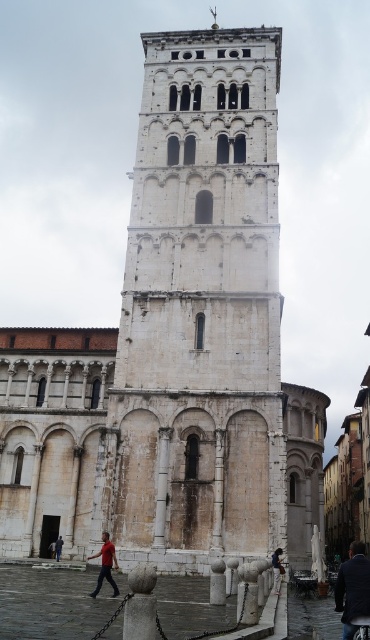
Question: Among these points, which one is farthest from the camera?

Choices:
 (A) (351, 556)
 (B) (112, 545)
 (C) (250, 48)

Answer: (A)

Question: Among these objects, which one is farthest from the camera?

Choices:
 (A) red cotton shirt at lower left
 (B) dark blue jeans at lower right
 (C) dark blue fabric jacket at lower right

Answer: (B)

Question: Can you confirm if red cotton shirt at lower left is positioned below dark blue jeans at lower right?

Choices:
 (A) no
 (B) yes

Answer: (A)

Question: Can you confirm if white stone bell tower at center is smaller than dark blue jeans at lower left?

Choices:
 (A) no
 (B) yes

Answer: (A)

Question: Which object appears closest to the camera in this image?

Choices:
 (A) dark blue jeans at lower right
 (B) dark blue jeans at lower left
 (C) white stone bell tower at center
 (D) dark blue fabric jacket at lower right

Answer: (D)

Question: Is dark blue fabric jacket at lower right thinner than dark blue jeans at lower right?

Choices:
 (A) no
 (B) yes

Answer: (A)